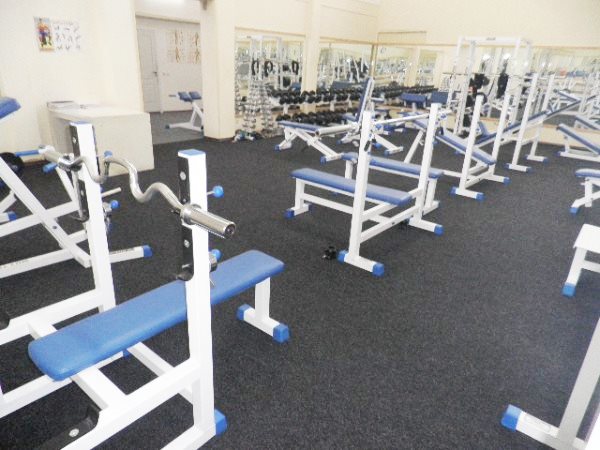
Where is `posters`? posters is located at coordinates [50, 38], [182, 37], [183, 58], [199, 39], [199, 54].